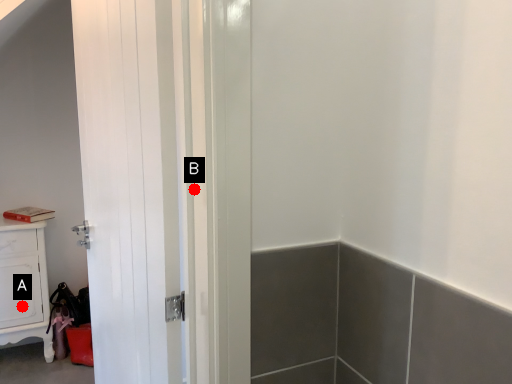
Question: Two points are circled on the image, labeled by A and B beside each circle. Which point is farther to the camera?

Choices:
 (A) A is further
 (B) B is further

Answer: (A)